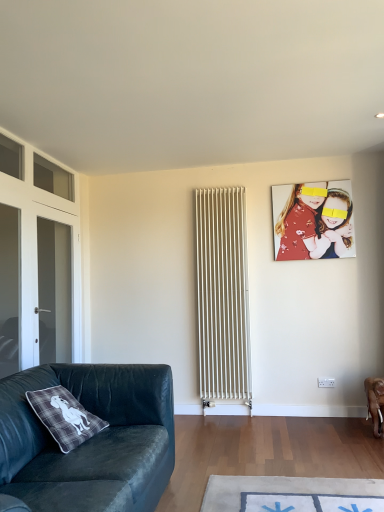
Question: From a real-world perspective, is transparent glass door at left, which is counted as the first glass door, starting from the front, positioned under velvet dark green couch at lower left based on gravity?

Choices:
 (A) no
 (B) yes

Answer: (A)

Question: Can you confirm if transparent glass door at left, which is counted as the second glass door, starting from the back, is thinner than velvet dark green couch at lower left?

Choices:
 (A) yes
 (B) no

Answer: (A)

Question: From the image's perspective, is transparent glass door at left, which is counted as the first glass door, starting from the front, over velvet dark green couch at lower left?

Choices:
 (A) yes
 (B) no

Answer: (A)

Question: Is transparent glass door at left, which is counted as the first glass door, starting from the front, not within velvet dark green couch at lower left?

Choices:
 (A) no
 (B) yes

Answer: (B)

Question: Considering the relative sizes of transparent glass door at left, which is counted as the second glass door, starting from the back, and velvet dark green couch at lower left in the image provided, is transparent glass door at left, which is counted as the second glass door, starting from the back, wider than velvet dark green couch at lower left?

Choices:
 (A) yes
 (B) no

Answer: (B)

Question: Does transparent glass door at left, which is counted as the second glass door, starting from the back, have a larger size compared to velvet dark green couch at lower left?

Choices:
 (A) yes
 (B) no

Answer: (B)

Question: Considering the relative sizes of white metal radiator at center and transparent glass door at left, the 1th glass door viewed from the back, in the image provided, is white metal radiator at center bigger than transparent glass door at left, the 1th glass door viewed from the back,?

Choices:
 (A) no
 (B) yes

Answer: (B)

Question: From a real-world perspective, is white metal radiator at center physically below transparent glass door at left, the 1th glass door viewed from the back?

Choices:
 (A) no
 (B) yes

Answer: (B)

Question: Can you confirm if white metal radiator at center is smaller than transparent glass door at left, the second glass door positioned from the front?

Choices:
 (A) yes
 (B) no

Answer: (B)

Question: Is white metal radiator at center beside transparent glass door at left, the 1th glass door viewed from the back?

Choices:
 (A) yes
 (B) no

Answer: (B)

Question: Is white metal radiator at center oriented away from transparent glass door at left, the second glass door positioned from the front?

Choices:
 (A) no
 (B) yes

Answer: (A)

Question: Are white metal radiator at center and transparent glass door at left, the 1th glass door viewed from the back, located far from each other?

Choices:
 (A) yes
 (B) no

Answer: (A)

Question: Can you confirm if transparent glass door at left, which is counted as the second glass door, starting from the back, is wider than matte red shirt at upper right?

Choices:
 (A) yes
 (B) no

Answer: (B)